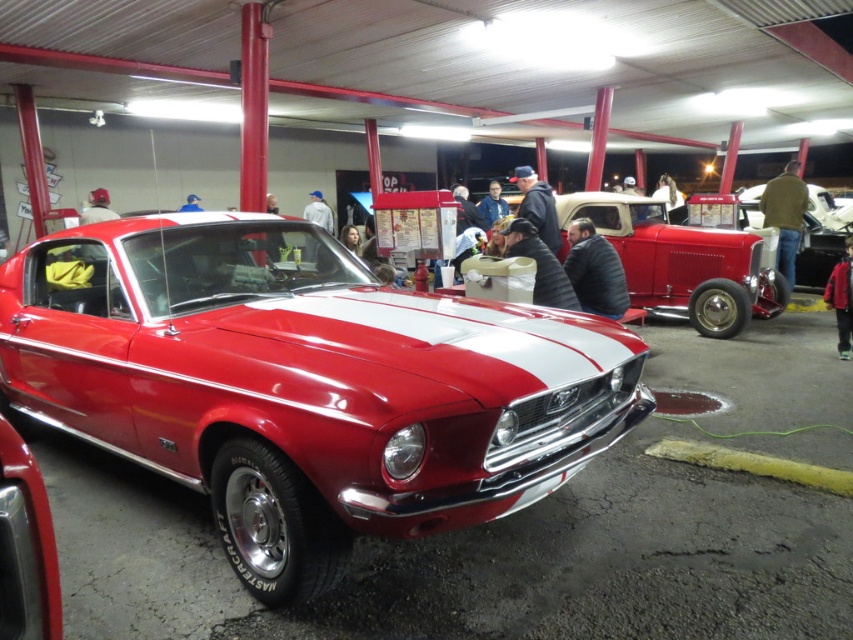
Does point (422, 340) lie behind point (590, 284)?

No.

Between point (138, 300) and point (587, 264), which one is positioned in front?

Point (138, 300) is in front.

Where is `shiny red car at center`? This screenshot has width=853, height=640. shiny red car at center is located at coordinates (305, 385).

How distant is shiny red car at center from gray fabric jacket at center?

They are 1.59 meters apart.

Between shiny red car at center and gray fabric jacket at center, which one has more height?

gray fabric jacket at center

Which is behind, point (107, 273) or point (314, 244)?

Point (314, 244)

At what (x,y) coordinates should I click in order to perform the action: click on shiny red car at center. Please return your answer as a coordinate pair (x, y). Looking at the image, I should click on (305, 385).

Is point (776, 253) positioned after point (505, 211)?

No, it is in front of (505, 211).

Does brown leather jacket at right appear over blue denim jacket at center?

No, brown leather jacket at right is not above blue denim jacket at center.

Does point (792, 272) come farther from viewer compared to point (480, 212)?

No.

I want to click on brown leather jacket at right, so [x=785, y=216].